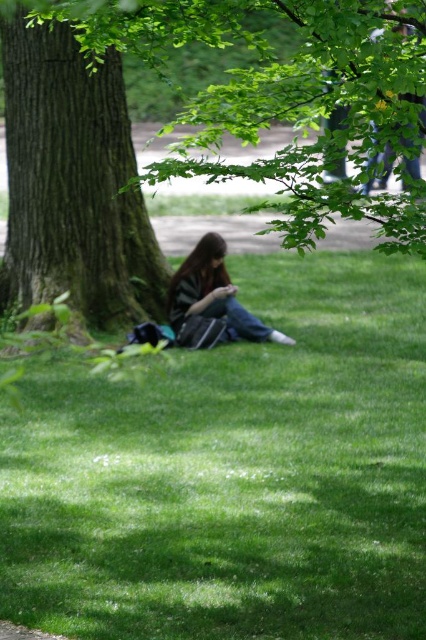
Can you confirm if green leafy tree at center is positioned above striped fabric shirt at center?

Indeed, green leafy tree at center is positioned over striped fabric shirt at center.

The width and height of the screenshot is (426, 640). I want to click on green leafy tree at center, so click(282, 99).

Between point (221, 176) and point (238, 323), which one is positioned behind?

The point (238, 323) is behind.

The width and height of the screenshot is (426, 640). Find the location of `green leafy tree at center`. green leafy tree at center is located at coordinates (282, 99).

Is green grass at lower left wider than dark brown textured tree trunk at left?

Yes, green grass at lower left is wider than dark brown textured tree trunk at left.

Who is positioned more to the left, green grass at lower left or dark brown textured tree trunk at left?

From the viewer's perspective, dark brown textured tree trunk at left appears more on the left side.

Is point (362, 564) behind point (89, 317)?

No, (362, 564) is in front of (89, 317).

The image size is (426, 640). I want to click on green grass at lower left, so click(x=233, y=474).

Consider the image. Does dark brown textured tree trunk at left have a smaller size compared to striped fabric shirt at center?

No, dark brown textured tree trunk at left is not smaller than striped fabric shirt at center.

Is point (106, 67) more distant than point (224, 262)?

That is False.

This screenshot has width=426, height=640. Identify the location of dark brown textured tree trunk at left. (74, 180).